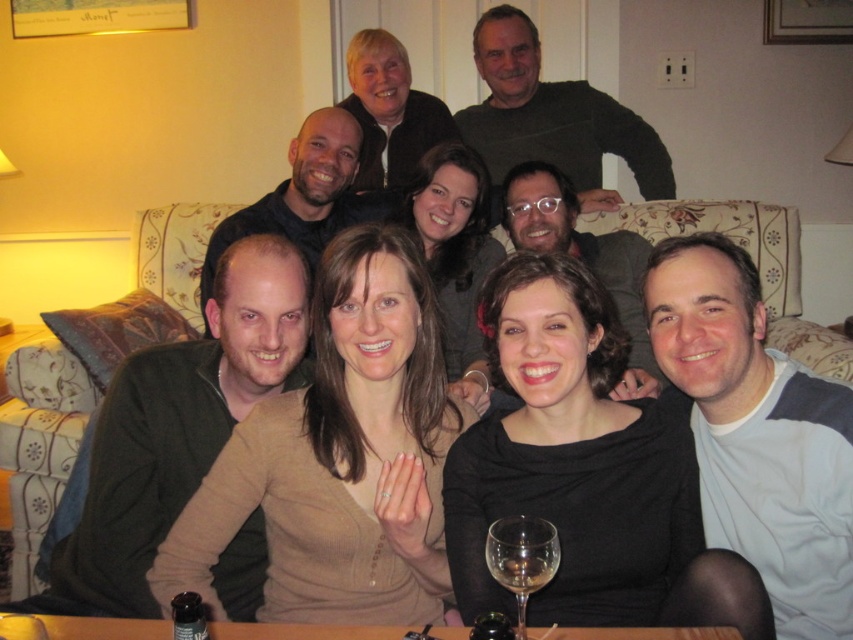
Which is more to the left, wooden table at lower center or clear glass wine glass at lower center?

wooden table at lower center

Between point (258, 625) and point (519, 540), which one is positioned behind?

Positioned behind is point (258, 625).

Which is in front, point (105, 625) or point (509, 528)?

Point (509, 528) is more forward.

Where is `wooden table at lower center`? The width and height of the screenshot is (853, 640). wooden table at lower center is located at coordinates (302, 632).